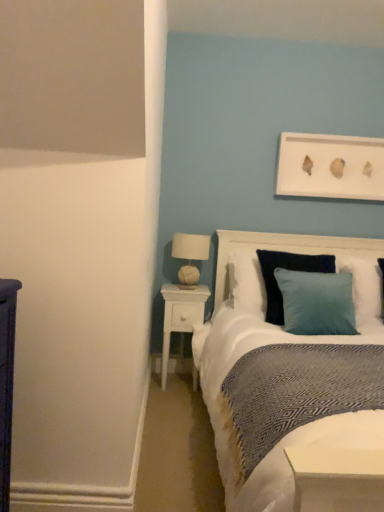
Question: Is white wood nightstand at center thinner than teal velvet pillow at center?

Choices:
 (A) yes
 (B) no

Answer: (A)

Question: Could you tell me if white wood nightstand at center is turned towards teal velvet pillow at center?

Choices:
 (A) yes
 (B) no

Answer: (B)

Question: From a real-world perspective, is white wood nightstand at center beneath teal velvet pillow at center?

Choices:
 (A) yes
 (B) no

Answer: (A)

Question: Is white wood nightstand at center at the left side of teal velvet pillow at center?

Choices:
 (A) no
 (B) yes

Answer: (B)

Question: Can you see white wood nightstand at center touching teal velvet pillow at center?

Choices:
 (A) yes
 (B) no

Answer: (B)

Question: Considering the relative sizes of white wood nightstand at center and teal velvet pillow at center in the image provided, is white wood nightstand at center taller than teal velvet pillow at center?

Choices:
 (A) no
 (B) yes

Answer: (B)

Question: Is teal velvet pillow at center thinner than white fabric-covered lampshade at upper right?

Choices:
 (A) yes
 (B) no

Answer: (B)

Question: Considering the relative sizes of teal velvet pillow at center and white fabric-covered lampshade at upper right in the image provided, is teal velvet pillow at center wider than white fabric-covered lampshade at upper right?

Choices:
 (A) no
 (B) yes

Answer: (B)

Question: Could you tell me if teal velvet pillow at center is turned towards white fabric-covered lampshade at upper right?

Choices:
 (A) yes
 (B) no

Answer: (B)

Question: From a real-world perspective, is teal velvet pillow at center beneath white fabric-covered lampshade at upper right?

Choices:
 (A) yes
 (B) no

Answer: (A)

Question: Is teal velvet pillow at center smaller than white fabric-covered lampshade at upper right?

Choices:
 (A) yes
 (B) no

Answer: (B)

Question: Is teal velvet pillow at center shorter than white fabric-covered lampshade at upper right?

Choices:
 (A) yes
 (B) no

Answer: (B)

Question: Is white fabric-covered lampshade at upper right positioned far away from white wood nightstand at center?

Choices:
 (A) yes
 (B) no

Answer: (B)